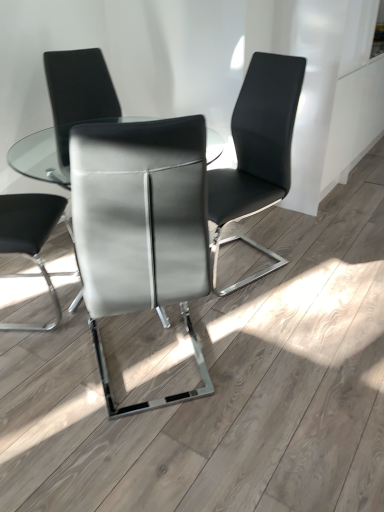
Image resolution: width=384 pixels, height=512 pixels. I want to click on empty space that is to the right of clear glass table at center, so 300,311.